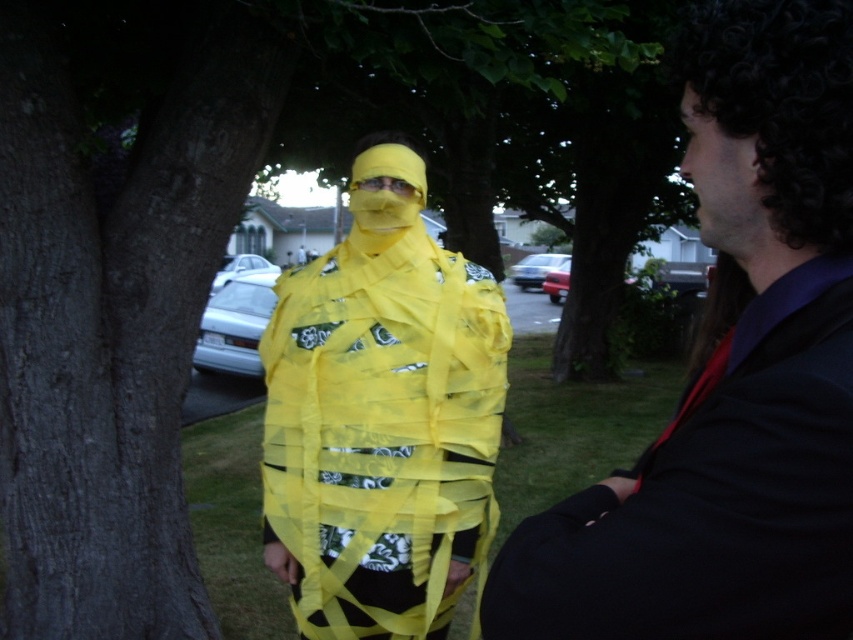
You are standing at the point marked as point (730, 376). Which object are you touching?

The point (730, 376) is on the shiny black suit at right, so you are touching the shiny black suit at right.

You are standing in a residential area with two points marked in the image. You need to place a small flag exactly halfway between the point at coordinate point (543, 515) and the point at coordinate point (341, 566). Will the flag be closer to the person wrapped in yellow tape or further away compared to the original points?

The flag placed halfway between point (543, 515) and point (341, 566) will be closer to the person wrapped in yellow tape because point (543, 515) is closer to the viewer than point (341, 566).